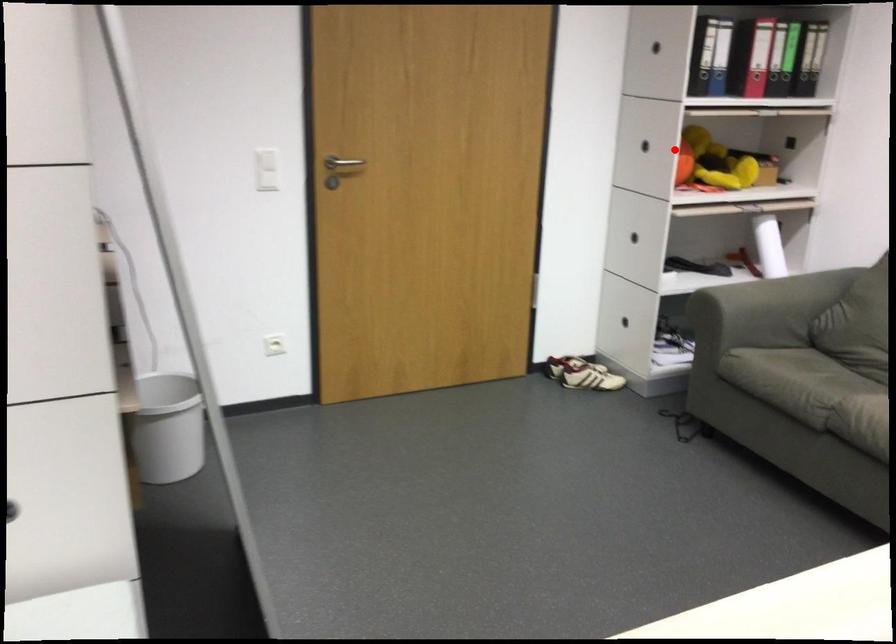
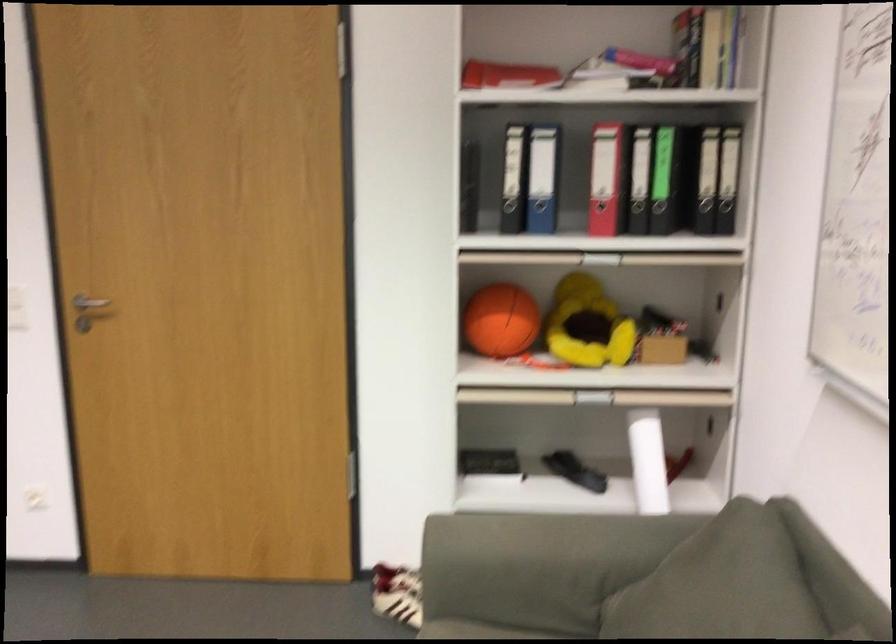
Where in the second image is the point corresponding to the highlighted location from the first image?

(501, 321)